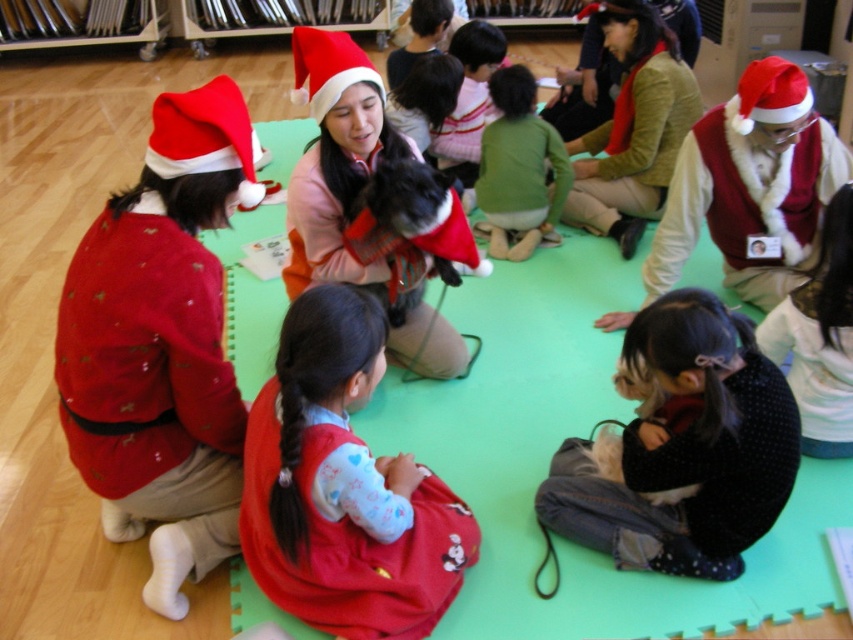
You are organizing a photo shoot and need to place a prop exactly at the coordinates mentioned in the scene. Where should you position the prop relative to the velvet red vest at upper right?

The velvet red vest at upper right is located at point (751, 184), so you should position the prop at those coordinates relative to it.